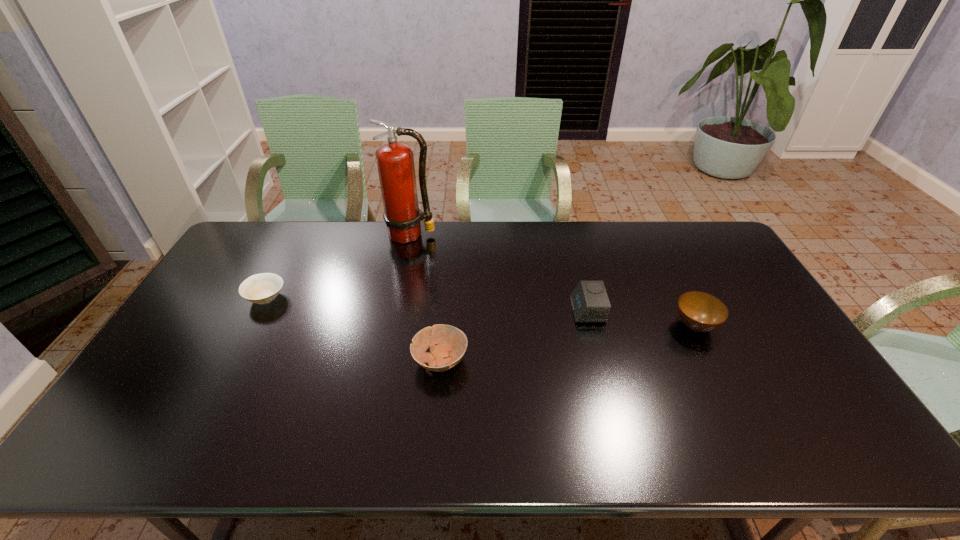
You are a GUI agent. You are given a task and a screenshot of the screen. Output one action in this format:
    pyautogui.click(x=<x>, y=<y>)
    Task: Click on the free spot between the shortest bowl and the second bowl from right to left
    The width and height of the screenshot is (960, 540).
    Given the screenshot: What is the action you would take?
    pyautogui.click(x=353, y=329)

Where is `empty space between the tallest object and the rightmost bowl`? Image resolution: width=960 pixels, height=540 pixels. empty space between the tallest object and the rightmost bowl is located at coordinates (553, 280).

Locate an element on the screen. object that can be found as the third closest to the shortest bowl is located at coordinates (589, 300).

The height and width of the screenshot is (540, 960). In order to click on object that stands as the second closest to the rightmost bowl in this screenshot , I will do `click(451, 342)`.

Find the location of a particular element. Image resolution: width=960 pixels, height=540 pixels. the closest bowl to the alarm clock is located at coordinates [x=699, y=311].

The image size is (960, 540). Find the location of `the closest bowl to the leftmost object`. the closest bowl to the leftmost object is located at coordinates (451, 342).

The image size is (960, 540). I want to click on vacant area in the image that satisfies the following two spatial constraints: 1. at the nozzle of the fire extinguisher; 2. on the left side of the second bowl from right to left, so click(385, 360).

Where is `vacant position in the image that satisfies the following two spatial constraints: 1. on the front-facing side of the rightmost bowl; 2. on the left side of the second object from right to left`? The width and height of the screenshot is (960, 540). vacant position in the image that satisfies the following two spatial constraints: 1. on the front-facing side of the rightmost bowl; 2. on the left side of the second object from right to left is located at coordinates (591, 325).